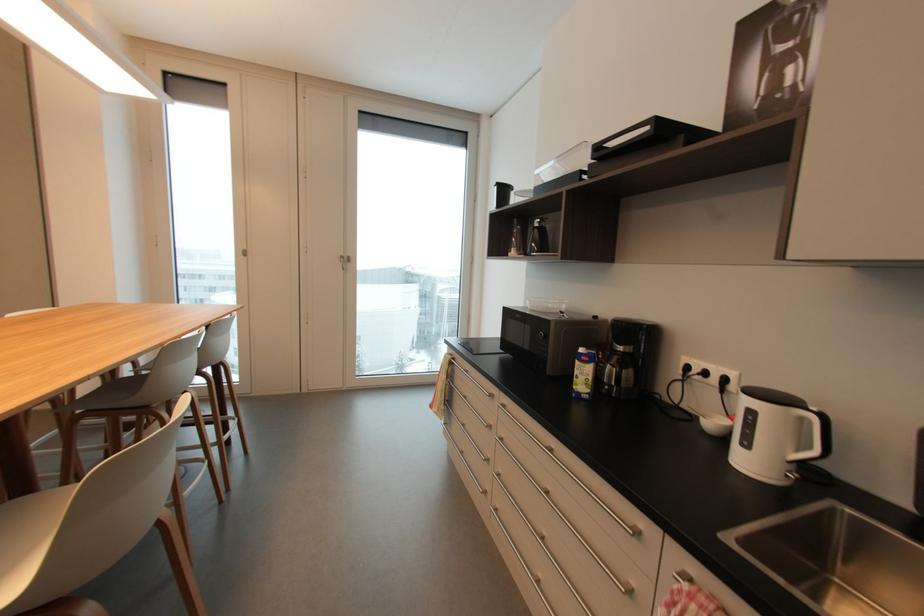
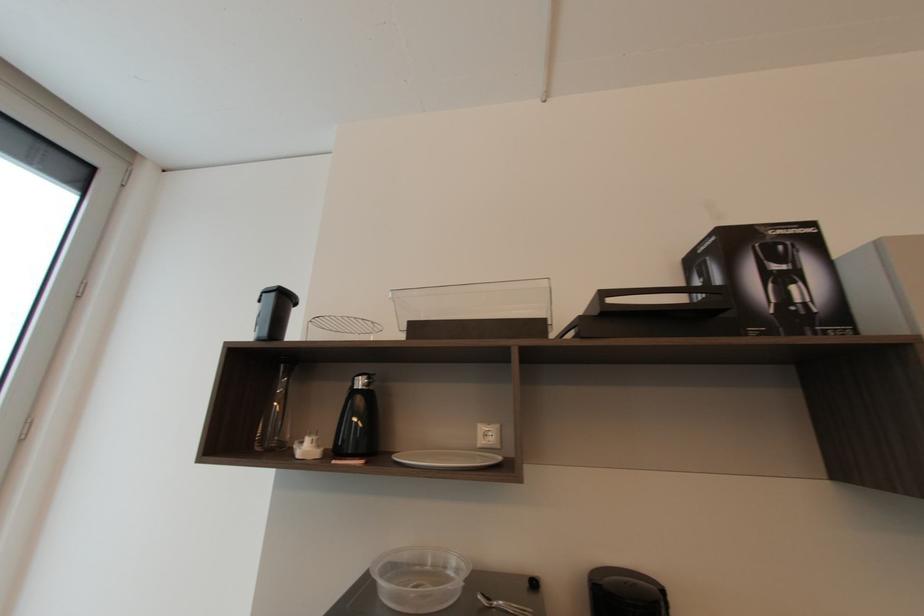
Find the pixel in the second image that matches (x=516, y=253) in the first image.

(310, 447)